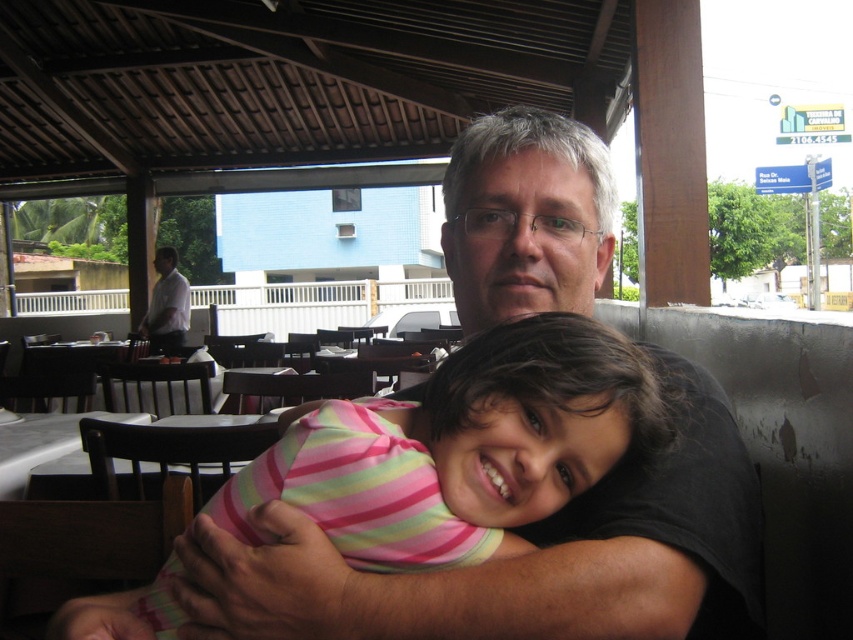
Can you confirm if pink striped shirt at center is smaller than white shirt at left?

Yes.

How distant is pink striped shirt at center from white shirt at left?

They are 5.55 meters apart.

Is point (355, 513) in front of point (161, 289)?

That is True.

Image resolution: width=853 pixels, height=640 pixels. Find the location of `pink striped shirt at center`. pink striped shirt at center is located at coordinates (460, 449).